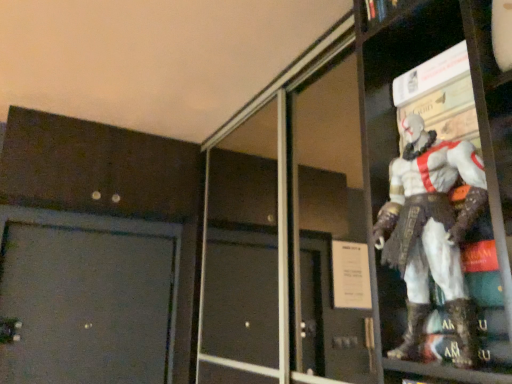
Question: Should I look upward or downward to see white matte figure at upper right?

Choices:
 (A) down
 (B) up

Answer: (A)

Question: From the image's perspective, is transparent glass screen door at upper right on white matte figure at upper right?

Choices:
 (A) no
 (B) yes

Answer: (A)

Question: Considering the relative sizes of transparent glass screen door at upper right and white matte figure at upper right in the image provided, is transparent glass screen door at upper right thinner than white matte figure at upper right?

Choices:
 (A) no
 (B) yes

Answer: (B)

Question: Is transparent glass screen door at upper right not close to white matte figure at upper right?

Choices:
 (A) no
 (B) yes

Answer: (B)

Question: Can white matte figure at upper right be found inside transparent glass screen door at upper right?

Choices:
 (A) no
 (B) yes

Answer: (A)

Question: Considering the relative sizes of transparent glass screen door at upper right and white matte figure at upper right in the image provided, is transparent glass screen door at upper right shorter than white matte figure at upper right?

Choices:
 (A) yes
 (B) no

Answer: (B)

Question: Does transparent glass screen door at upper right lie in front of white matte figure at upper right?

Choices:
 (A) no
 (B) yes

Answer: (A)

Question: Would you say white matte figure at upper right contains transparent glass screen door at upper right?

Choices:
 (A) yes
 (B) no

Answer: (B)

Question: Is white matte figure at upper right aimed at transparent glass screen door at upper right?

Choices:
 (A) yes
 (B) no

Answer: (B)

Question: Can you confirm if white matte figure at upper right is positioned to the left of transparent glass screen door at upper right?

Choices:
 (A) no
 (B) yes

Answer: (A)

Question: Is white matte figure at upper right next to transparent glass screen door at upper right?

Choices:
 (A) no
 (B) yes

Answer: (A)

Question: Considering the relative sizes of white matte figure at upper right and transparent glass screen door at upper right in the image provided, is white matte figure at upper right thinner than transparent glass screen door at upper right?

Choices:
 (A) no
 (B) yes

Answer: (A)

Question: From a real-world perspective, is white matte figure at upper right below transparent glass screen door at upper right?

Choices:
 (A) yes
 (B) no

Answer: (A)

Question: Is white matte figure at upper right wider or thinner than transparent glass screen door at upper right?

Choices:
 (A) thin
 (B) wide

Answer: (B)